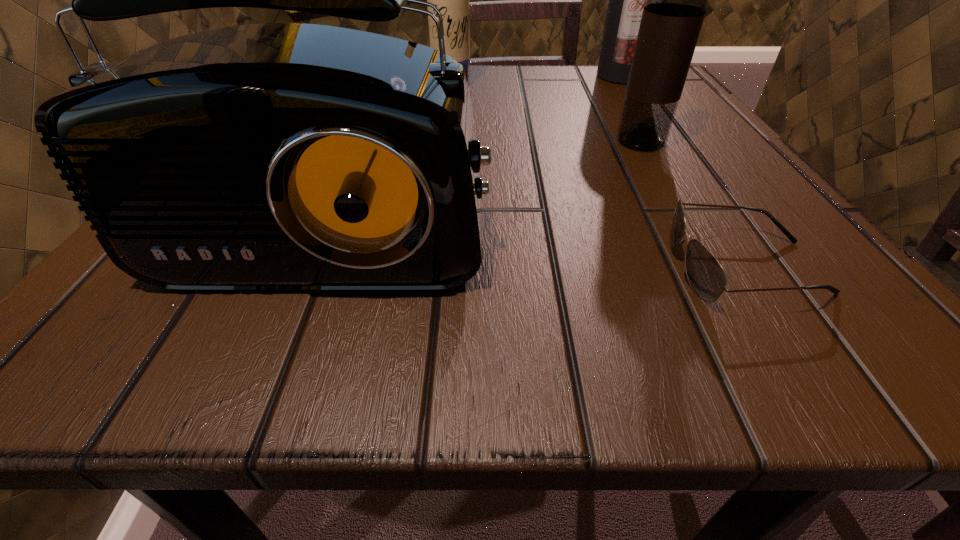
You are a GUI agent. You are given a task and a screenshot of the screen. Output one action in this format:
    pyautogui.click(x=<x>, y=<y>)
    Task: Click on the free space at the near right corner
    
    Given the screenshot: What is the action you would take?
    pyautogui.click(x=748, y=315)

Find the location of a particular element. Image resolution: width=960 pixels, height=540 pixels. empty space between the fourth tallest object and the shortest object is located at coordinates (547, 231).

Image resolution: width=960 pixels, height=540 pixels. I want to click on blank region between the nearest wine bottle and the leftmost wine bottle, so click(546, 114).

Locate an element on the screen. The height and width of the screenshot is (540, 960). free space between the nearest wine bottle and the radio receiver is located at coordinates (494, 168).

Locate an element on the screen. This screenshot has height=540, width=960. object that stands as the fourth closest to the nearest wine bottle is located at coordinates point(452,0).

At what (x,y) coordinates should I click in order to perform the action: click on object that is the fourth closest one to the shortest object. Please return your answer as a coordinate pair (x, y). The width and height of the screenshot is (960, 540). Looking at the image, I should click on (452, 0).

Locate which wine bottle ranks in proximity to the nearest wine bottle. Please provide its 2D coordinates. Your answer should be formatted as a tuple, i.e. [(x, y)], where the tuple contains the x and y coordinates of a point satisfying the conditions above.

[(626, 0)]

Image resolution: width=960 pixels, height=540 pixels. I want to click on wine bottle identified as the second closest to the shortest object, so pos(626,0).